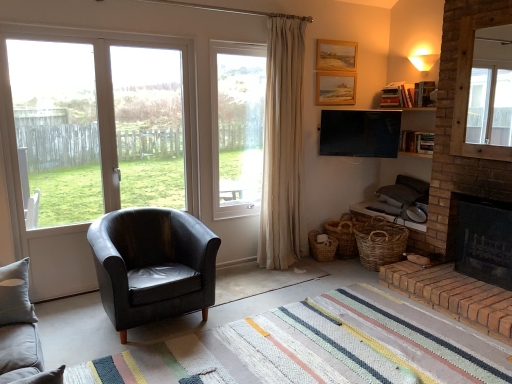
Question: Does transparent glass door at left, which is counted as the first window screen, starting from the left, have a lesser width compared to flat screen tv at upper center?

Choices:
 (A) yes
 (B) no

Answer: (A)

Question: Does transparent glass door at left, which is counted as the first window screen, starting from the left, lie behind flat screen tv at upper center?

Choices:
 (A) yes
 (B) no

Answer: (B)

Question: Considering the relative sizes of transparent glass door at left, which is the 2th window screen in right-to-left order, and flat screen tv at upper center in the image provided, is transparent glass door at left, which is the 2th window screen in right-to-left order, taller than flat screen tv at upper center?

Choices:
 (A) no
 (B) yes

Answer: (B)

Question: Is transparent glass door at left, which is the 2th window screen in right-to-left order, positioned before flat screen tv at upper center?

Choices:
 (A) no
 (B) yes

Answer: (B)

Question: Is transparent glass door at left, which is counted as the first window screen, starting from the left, at the right side of flat screen tv at upper center?

Choices:
 (A) no
 (B) yes

Answer: (A)

Question: Is transparent glass door at left, which is counted as the first window screen, starting from the left, positioned with its back to flat screen tv at upper center?

Choices:
 (A) yes
 (B) no

Answer: (B)

Question: Considering the relative sizes of woven brown basket at lower right, which is the first basket from left to right, and woven brown baskets at lower right, which is counted as the first basket, starting from the right, in the image provided, is woven brown basket at lower right, which is the first basket from left to right, smaller than woven brown baskets at lower right, which is counted as the first basket, starting from the right,?

Choices:
 (A) yes
 (B) no

Answer: (A)

Question: Is woven brown basket at lower right, the second basket when ordered from right to left, bigger than woven brown baskets at lower right, which appears as the second basket when viewed from the left?

Choices:
 (A) yes
 (B) no

Answer: (B)

Question: Is woven brown basket at lower right, the second basket when ordered from right to left, to the right of woven brown baskets at lower right, which appears as the second basket when viewed from the left, from the viewer's perspective?

Choices:
 (A) no
 (B) yes

Answer: (A)

Question: Is woven brown basket at lower right, the second basket when ordered from right to left, in contact with woven brown baskets at lower right, which appears as the second basket when viewed from the left?

Choices:
 (A) yes
 (B) no

Answer: (B)

Question: Would you say woven brown basket at lower right, the second basket when ordered from right to left, contains woven brown baskets at lower right, which appears as the second basket when viewed from the left?

Choices:
 (A) yes
 (B) no

Answer: (B)

Question: Is woven brown basket at lower right, which is the first basket from left to right, shorter than woven brown baskets at lower right, which is counted as the first basket, starting from the right?

Choices:
 (A) yes
 (B) no

Answer: (A)

Question: Considering the relative positions of rug at center and transparent glass window at left, marked as the first window screen in a right-to-left arrangement, in the image provided, is rug at center to the right of transparent glass window at left, marked as the first window screen in a right-to-left arrangement, from the viewer's perspective?

Choices:
 (A) yes
 (B) no

Answer: (A)